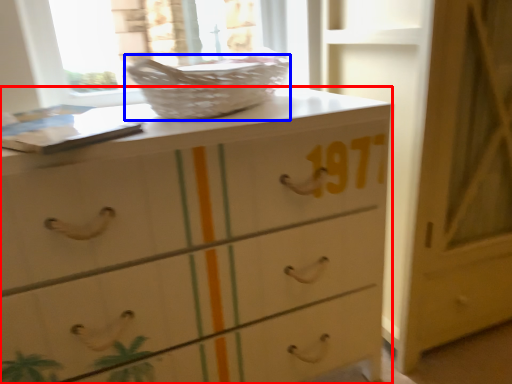
Question: Which of the following is the farthest to the observer, chest of drawers (highlighted by a red box) or basket (highlighted by a blue box)?

Choices:
 (A) chest of drawers
 (B) basket

Answer: (B)